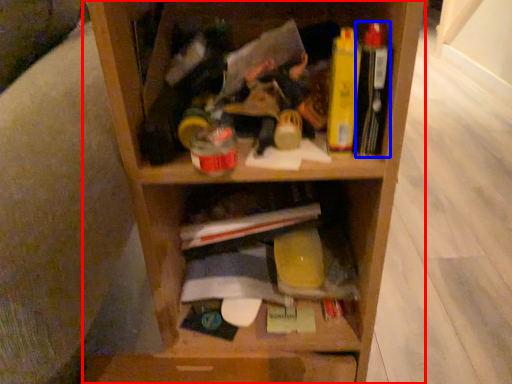
Question: Which object appears farthest to the camera in this image, shelf (highlighted by a red box) or book (highlighted by a blue box)?

Choices:
 (A) shelf
 (B) book

Answer: (B)